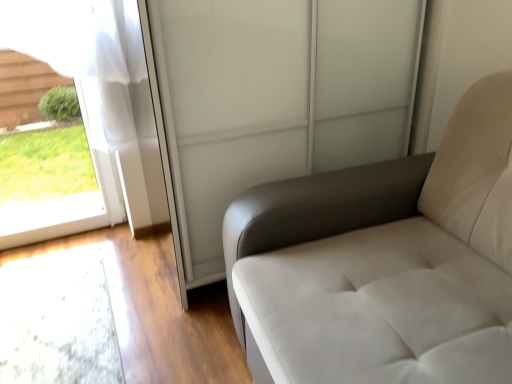
Question: From the image's perspective, is transparent glass screen door at upper center above or below white leather armchair at right?

Choices:
 (A) below
 (B) above

Answer: (B)

Question: Considering the relative positions of transparent glass screen door at upper center and white leather armchair at right in the image provided, is transparent glass screen door at upper center to the left or to the right of white leather armchair at right?

Choices:
 (A) right
 (B) left

Answer: (B)

Question: Which of these objects is positioned farthest from the clear glass window at left?

Choices:
 (A) white leather armchair at right
 (B) transparent glass screen door at upper center

Answer: (A)

Question: Which object is the farthest from the transparent glass screen door at upper center?

Choices:
 (A) clear glass window at left
 (B) white leather armchair at right

Answer: (A)